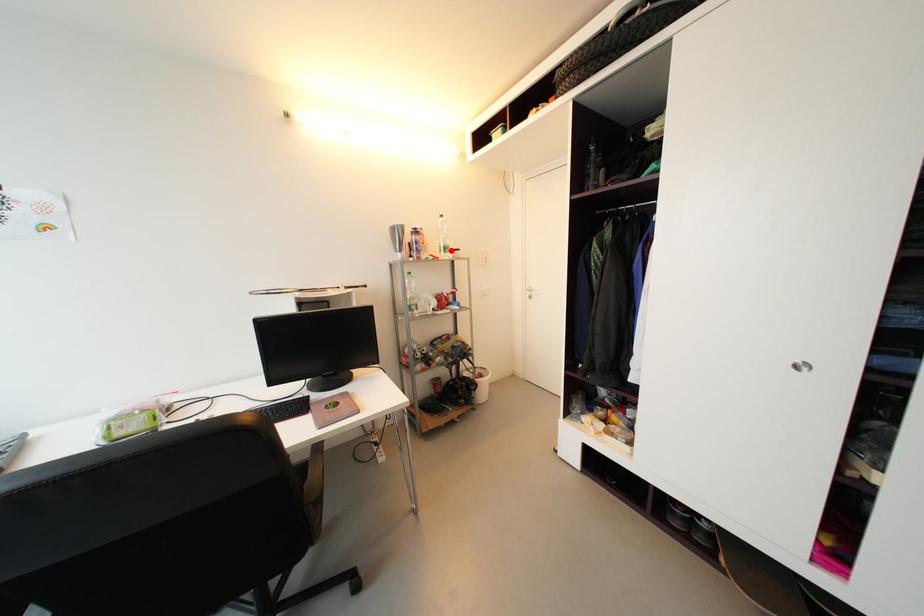
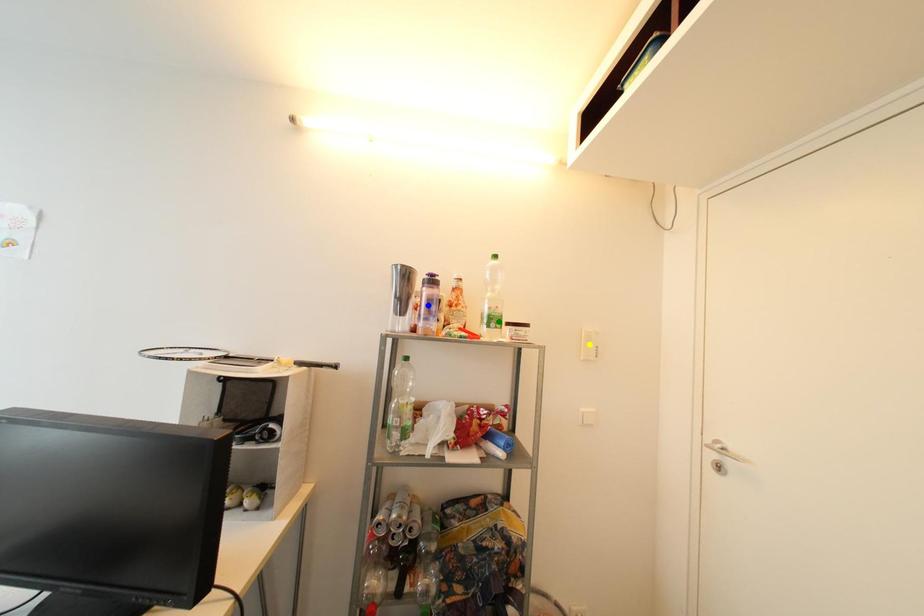
Question: I am providing you with two images of the same scene from different viewpoints. A red point is marked on the first image. You are given multiple points on the second image. Which point in image 2 is actually the same real-world point as the red point in image 1?

Choices:
 (A) yellow point
 (B) blue point
 (C) green point

Answer: (C)